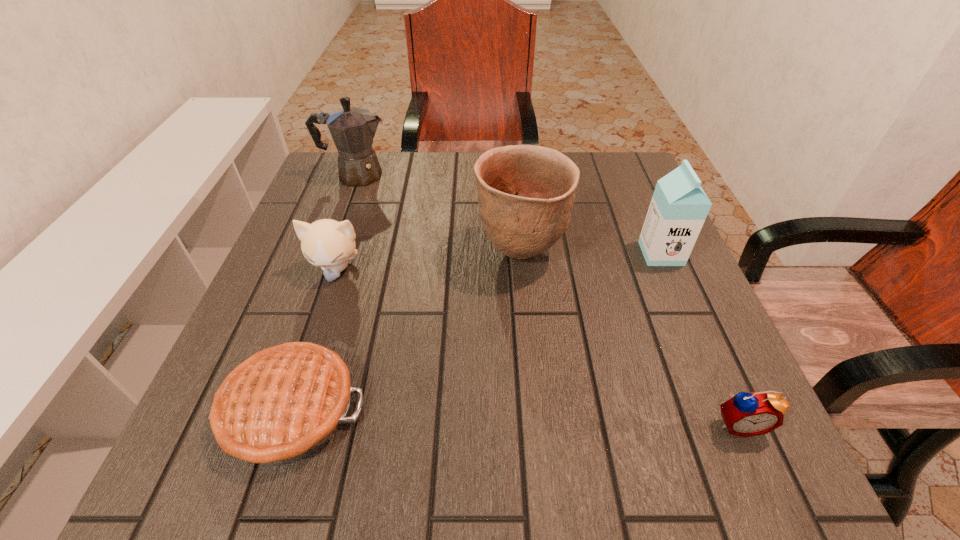
I want to click on blank space that satisfies the following two spatial constraints: 1. on the pouring side of the third object from right to left; 2. on the left side of the coffeepot, so click(327, 253).

Locate an element on the screen. The height and width of the screenshot is (540, 960). free space in the image that satisfies the following two spatial constraints: 1. on the pouring side of the milk carton; 2. on the left side of the coffeepot is located at coordinates (327, 253).